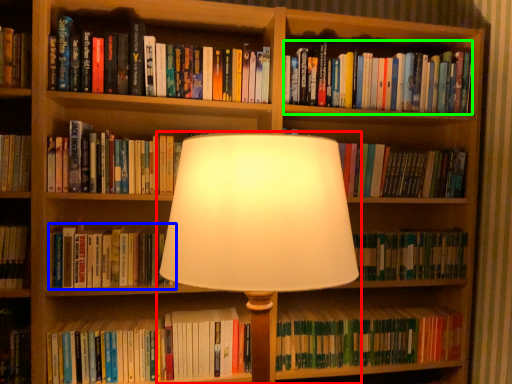
Question: Based on their relative distances, which object is nearer to lamp (highlighted by a red box)? Choose from book (highlighted by a blue box) and book (highlighted by a green box).

Choices:
 (A) book
 (B) book

Answer: (A)